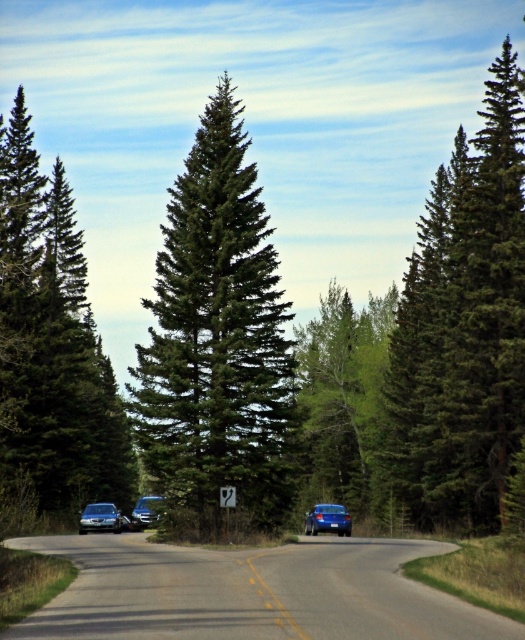
You are driving a car and see the green textured pine tree at left and the satin silver sedan at lower left. Which object is closer to the left edge of the road?

The green textured pine tree at left is positioned on the left side of the satin silver sedan at lower left, meaning it is closer to the left edge of the road.

You are driving a car and see the green textured pine tree at left and the shiny blue sedan at center. Which object is closer to you?

The green textured pine tree at left is closer to you because it is in front of the shiny blue sedan at center.